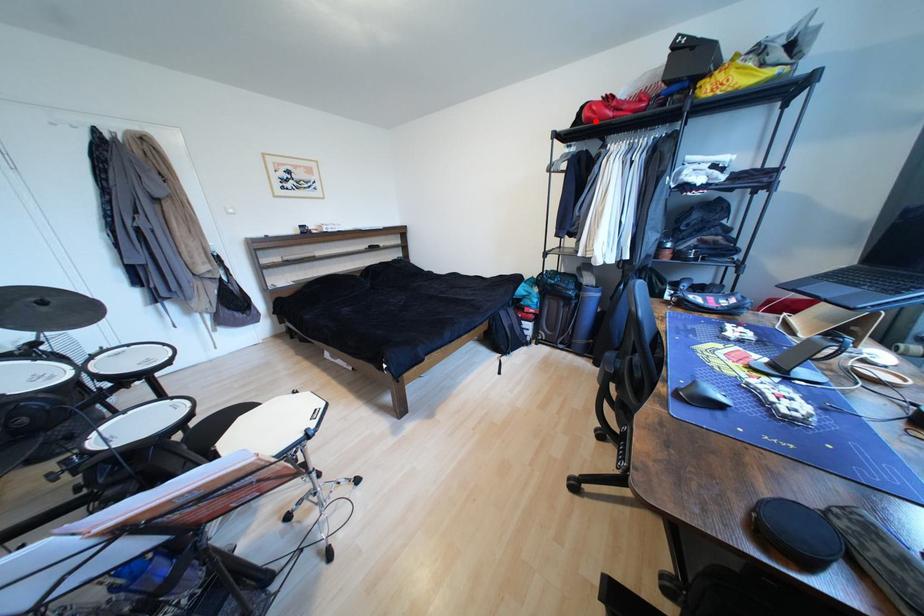
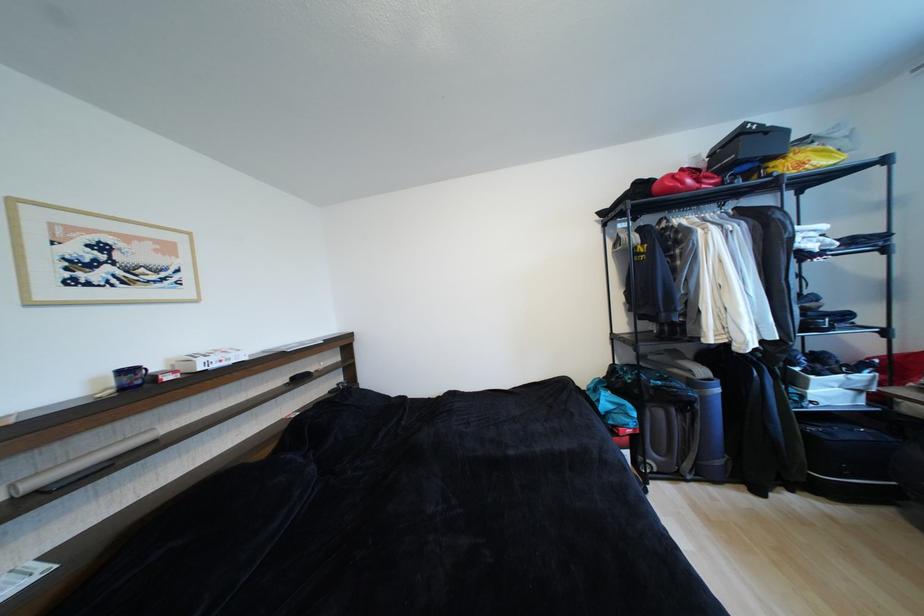
Locate, in the second image, the point that corresponds to the highlighted location in the first image.

(676, 192)